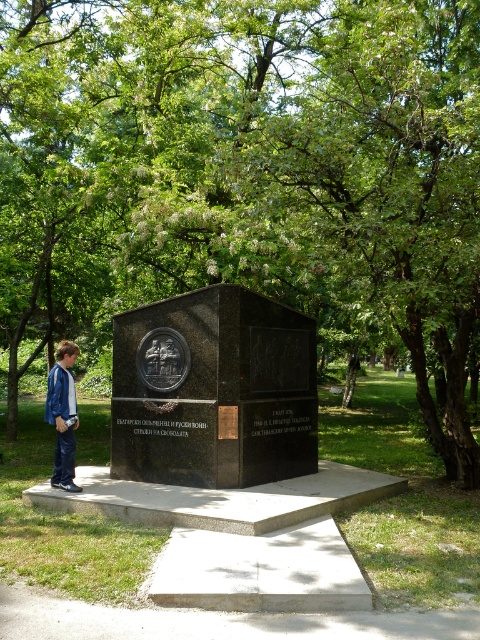
Question: Does black polished stone monument at center have a larger size compared to blue denim jacket at lower left?

Choices:
 (A) no
 (B) yes

Answer: (B)

Question: Which of the following is the closest to the observer?

Choices:
 (A) black polished stone monument at center
 (B) blue denim jacket at lower left

Answer: (B)

Question: Considering the relative positions of black polished stone monument at center and blue denim jacket at lower left in the image provided, where is black polished stone monument at center located with respect to blue denim jacket at lower left?

Choices:
 (A) right
 (B) left

Answer: (A)

Question: Which point is closer to the camera?

Choices:
 (A) black polished stone monument at center
 (B) blue denim jacket at lower left

Answer: (B)

Question: Can you confirm if black polished stone monument at center is positioned below blue denim jacket at lower left?

Choices:
 (A) yes
 (B) no

Answer: (B)

Question: Among these objects, which one is nearest to the camera?

Choices:
 (A) blue denim jacket at lower left
 (B) black polished stone monument at center

Answer: (A)